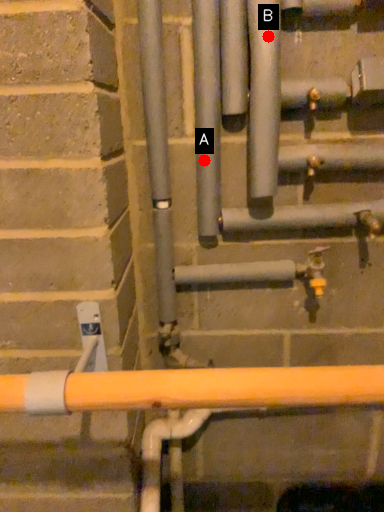
Question: Two points are circled on the image, labeled by A and B beside each circle. Which point is farther from the camera taking this photo?

Choices:
 (A) A is further
 (B) B is further

Answer: (A)